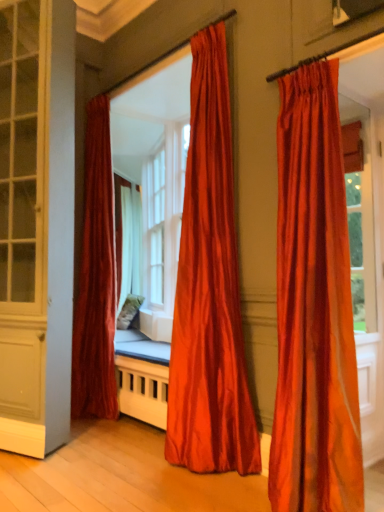
Question: Is satin orange curtain at right, which is the first curtain in front-to-back order, outside white glass bay window at center?

Choices:
 (A) no
 (B) yes

Answer: (B)

Question: From a real-world perspective, is satin orange curtain at right, which appears as the third curtain when viewed from the left, positioned over white glass bay window at center based on gravity?

Choices:
 (A) yes
 (B) no

Answer: (B)

Question: Is satin orange curtain at right, which appears as the third curtain when viewed from the back, oriented towards white glass bay window at center?

Choices:
 (A) yes
 (B) no

Answer: (B)

Question: Would you say satin orange curtain at right, placed as the 1th curtain when sorted from right to left, contains white glass bay window at center?

Choices:
 (A) no
 (B) yes

Answer: (A)

Question: Considering the relative sizes of satin orange curtain at right, which appears as the third curtain when viewed from the back, and white glass bay window at center in the image provided, is satin orange curtain at right, which appears as the third curtain when viewed from the back, wider than white glass bay window at center?

Choices:
 (A) no
 (B) yes

Answer: (B)

Question: Is satin orange curtain at right, which appears as the third curtain when viewed from the left, facing away from white glass bay window at center?

Choices:
 (A) yes
 (B) no

Answer: (B)

Question: Can you confirm if satin orange curtain at right, which appears as the third curtain when viewed from the back, is positioned to the left of matte white screen door at left?

Choices:
 (A) no
 (B) yes

Answer: (A)

Question: Does satin orange curtain at right, which appears as the third curtain when viewed from the left, lie behind matte white screen door at left?

Choices:
 (A) no
 (B) yes

Answer: (A)

Question: Does satin orange curtain at right, which is the first curtain in front-to-back order, have a greater height compared to matte white screen door at left?

Choices:
 (A) no
 (B) yes

Answer: (A)

Question: Could you tell me if satin orange curtain at right, which is the first curtain in front-to-back order, is turned towards matte white screen door at left?

Choices:
 (A) no
 (B) yes

Answer: (A)

Question: From a real-world perspective, is satin orange curtain at right, placed as the 1th curtain when sorted from right to left, beneath matte white screen door at left?

Choices:
 (A) yes
 (B) no

Answer: (A)

Question: Considering the relative sizes of satin orange curtain at right, which is the first curtain in front-to-back order, and matte white screen door at left in the image provided, is satin orange curtain at right, which is the first curtain in front-to-back order, smaller than matte white screen door at left?

Choices:
 (A) no
 (B) yes

Answer: (B)

Question: Is matte white screen door at left facing towards satin orange curtain at center, arranged as the second curtain when viewed from the front?

Choices:
 (A) no
 (B) yes

Answer: (A)